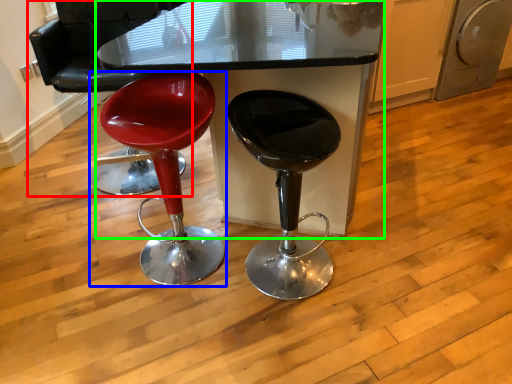
Question: Considering the real-world distances, which object is closest to chair (highlighted by a red box)? stool (highlighted by a blue box) or table (highlighted by a green box).

Choices:
 (A) stool
 (B) table

Answer: (A)